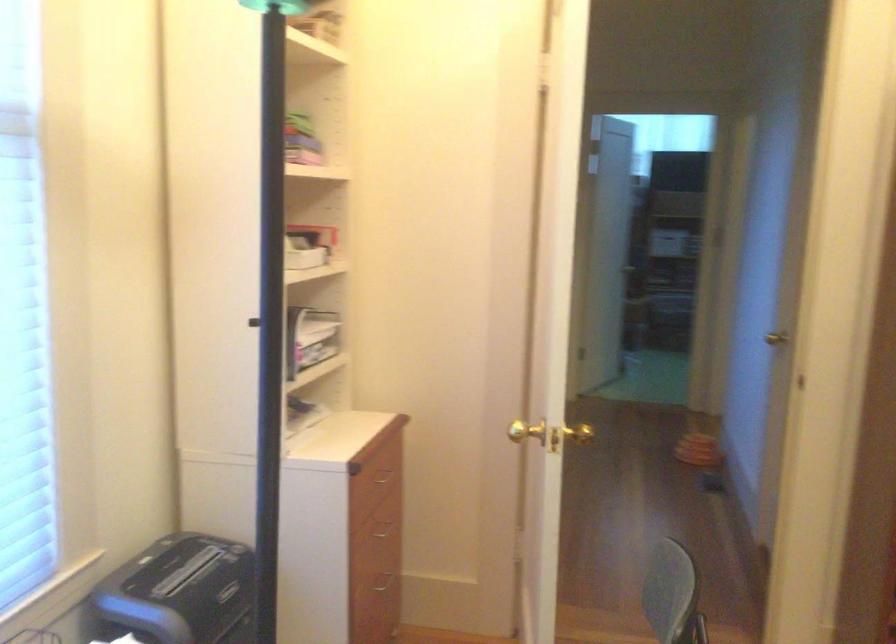
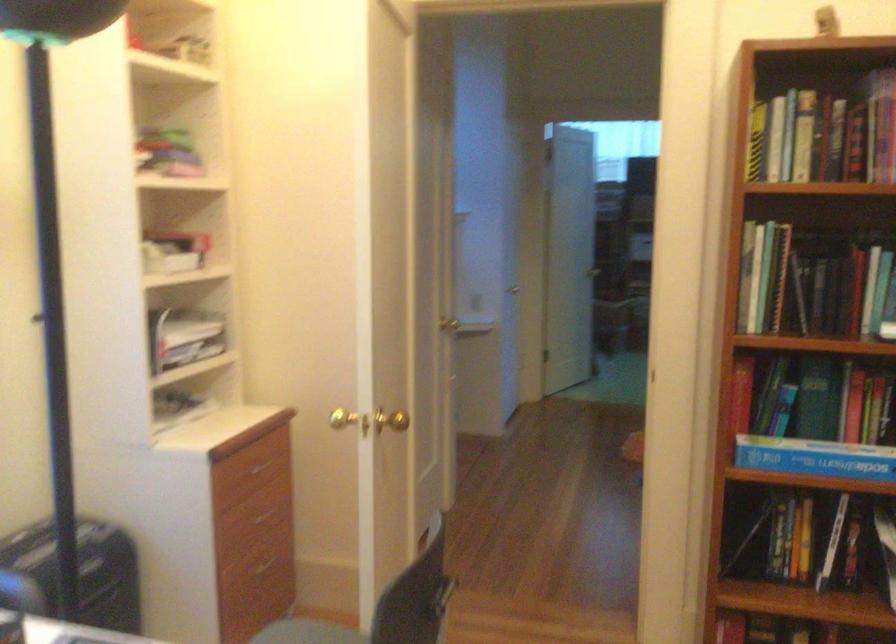
Question: The camera is either moving clockwise (left) or counter-clockwise (right) around the object. The first image is from the beginning of the video and the second image is from the end. Is the camera moving left or right when shooting the video?

Choices:
 (A) Left
 (B) Right

Answer: (B)